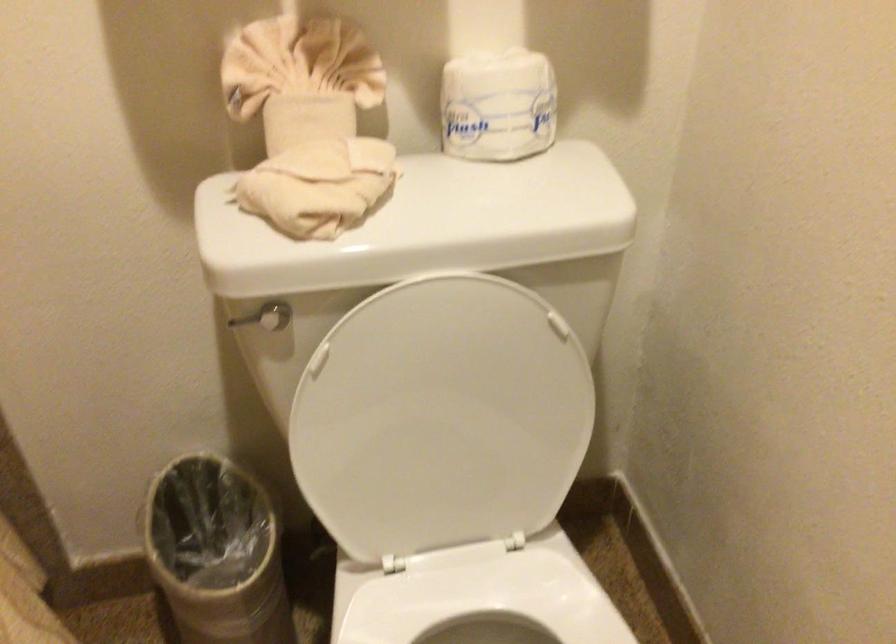
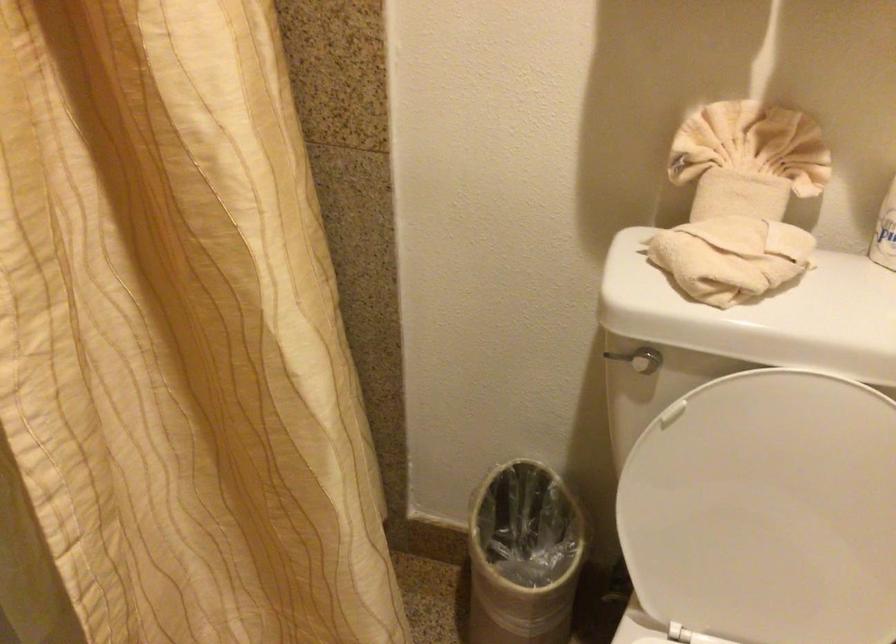
Locate, in the second image, the point that corresponds to point (220, 554) in the first image.

(522, 556)